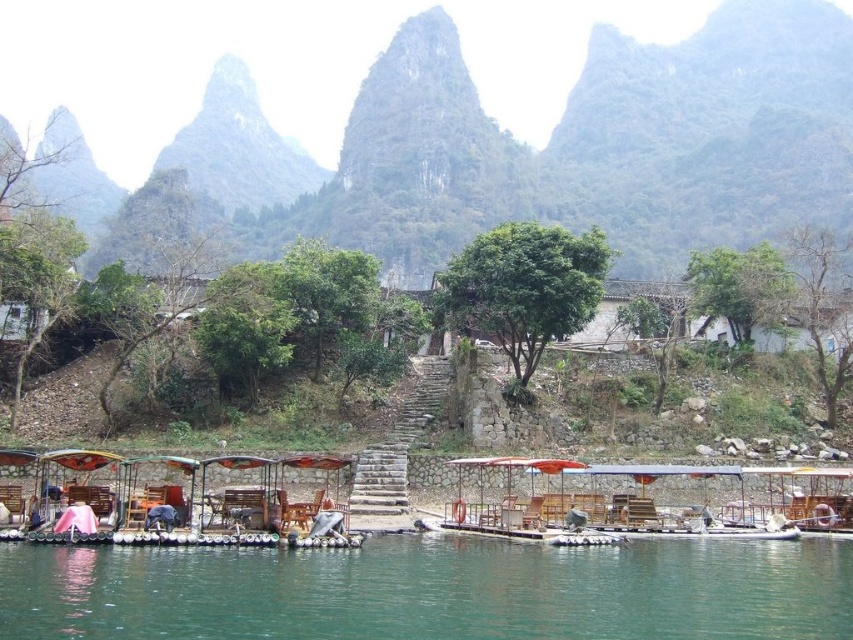
You are standing on the wooden boat at lower left and want to look at the green textured mountain at upper center. In which direction should you turn your head to see it?

The green textured mountain at upper center is positioned on the right side of wooden boat at lower left, so you should turn your head to the right to see it.

You are standing at the point labeled point (431,589) in the image. What is the color of the surface you are currently standing on?

The point (431,589) indicates green water at lower center, so the surface you are standing on is green water.